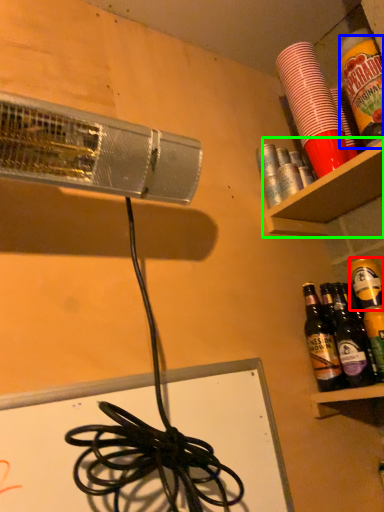
Question: Which object is positioned farthest from beer (highlighted by a red box)? Select from beverage (highlighted by a blue box) and shelf (highlighted by a green box).

Choices:
 (A) beverage
 (B) shelf

Answer: (A)